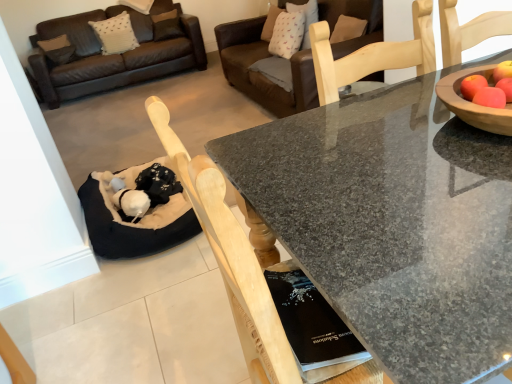
Question: From a real-world perspective, is black fabric cat bed at lower left beneath brown leather couch at upper center?

Choices:
 (A) yes
 (B) no

Answer: (A)

Question: From a real-world perspective, is black fabric cat bed at lower left positioned over brown leather couch at upper center based on gravity?

Choices:
 (A) no
 (B) yes

Answer: (A)

Question: Is black fabric cat bed at lower left oriented away from brown leather couch at upper center?

Choices:
 (A) no
 (B) yes

Answer: (A)

Question: Is black fabric cat bed at lower left positioned far away from brown leather couch at upper center?

Choices:
 (A) yes
 (B) no

Answer: (A)

Question: Is black fabric cat bed at lower left taller than brown leather couch at upper center?

Choices:
 (A) no
 (B) yes

Answer: (A)

Question: From the image's perspective, does black fabric cat bed at lower left appear higher than brown leather couch at upper center?

Choices:
 (A) no
 (B) yes

Answer: (A)

Question: Does brown leather couch at upper center have a larger size compared to granite table at center?

Choices:
 (A) yes
 (B) no

Answer: (A)

Question: Is the position of brown leather couch at upper center less distant than that of granite table at center?

Choices:
 (A) no
 (B) yes

Answer: (A)

Question: Is brown leather couch at upper center wider than granite table at center?

Choices:
 (A) no
 (B) yes

Answer: (A)

Question: Is brown leather couch at upper center beside granite table at center?

Choices:
 (A) yes
 (B) no

Answer: (B)

Question: From a real-world perspective, is brown leather couch at upper center on top of granite table at center?

Choices:
 (A) no
 (B) yes

Answer: (B)

Question: Could you tell me if brown leather couch at upper center is turned towards granite table at center?

Choices:
 (A) no
 (B) yes

Answer: (A)

Question: Considering the relative sizes of brown leather couch at upper center and black fabric cat bed at lower left in the image provided, is brown leather couch at upper center shorter than black fabric cat bed at lower left?

Choices:
 (A) yes
 (B) no

Answer: (B)